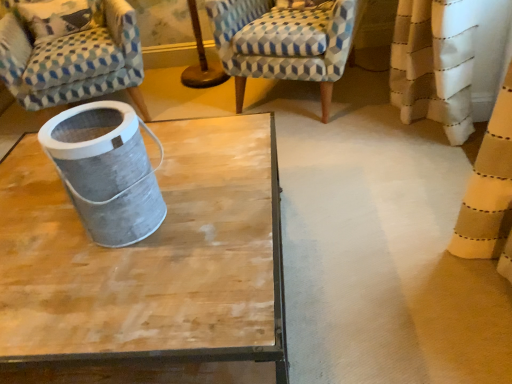
Question: Would you say patterned fabric armchair at upper left, which ranks as the first chair in left-to-right order, is to the left or to the right of patterned fabric armchair at upper center, marked as the 1th chair in a right-to-left arrangement, in the picture?

Choices:
 (A) left
 (B) right

Answer: (A)

Question: In terms of height, does patterned fabric armchair at upper left, which ranks as the first chair in left-to-right order, look taller or shorter compared to patterned fabric armchair at upper center, the second chair when ordered from left to right?

Choices:
 (A) short
 (B) tall

Answer: (B)

Question: Considering the positions of patterned fabric armchair at upper left, the 2th chair in the right-to-left sequence, and patterned fabric armchair at upper center, marked as the 1th chair in a right-to-left arrangement, in the image, is patterned fabric armchair at upper left, the 2th chair in the right-to-left sequence, wider or thinner than patterned fabric armchair at upper center, marked as the 1th chair in a right-to-left arrangement,?

Choices:
 (A) thin
 (B) wide

Answer: (B)

Question: Considering the positions of patterned fabric armchair at upper center, marked as the 1th chair in a right-to-left arrangement, and patterned fabric armchair at upper left, which ranks as the first chair in left-to-right order, in the image, is patterned fabric armchair at upper center, marked as the 1th chair in a right-to-left arrangement, bigger or smaller than patterned fabric armchair at upper left, which ranks as the first chair in left-to-right order,?

Choices:
 (A) big
 (B) small

Answer: (B)

Question: From the image's perspective, is patterned fabric armchair at upper center, marked as the 1th chair in a right-to-left arrangement, positioned above or below patterned fabric armchair at upper left, the 2th chair in the right-to-left sequence?

Choices:
 (A) above
 (B) below

Answer: (A)

Question: Is patterned fabric armchair at upper center, the second chair when ordered from left to right, situated inside patterned fabric armchair at upper left, which ranks as the first chair in left-to-right order, or outside?

Choices:
 (A) inside
 (B) outside

Answer: (B)

Question: In terms of height, does patterned fabric armchair at upper center, the second chair when ordered from left to right, look taller or shorter compared to patterned fabric armchair at upper left, the 2th chair in the right-to-left sequence?

Choices:
 (A) short
 (B) tall

Answer: (A)